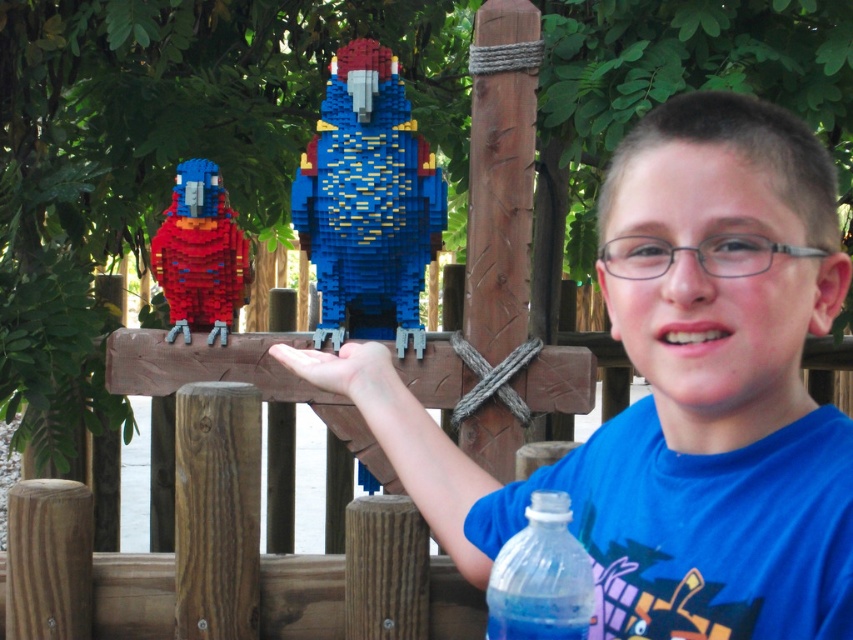
Question: Which point is closer to the camera?

Choices:
 (A) matte flesh-colored hand at center
 (B) blue matte lego figure at upper center
 (C) blue lego parrot at center

Answer: (B)

Question: Which point appears farthest from the camera in this image?

Choices:
 (A) (334, 285)
 (B) (308, 349)
 (C) (532, 563)

Answer: (A)

Question: Can you confirm if blue lego parrot at center is positioned to the right of transparent plastic bottle at lower right?

Choices:
 (A) no
 (B) yes

Answer: (A)

Question: Is blue matte lego figure at upper center wider than transparent plastic bottle at lower right?

Choices:
 (A) no
 (B) yes

Answer: (B)

Question: Which of the following is the closest to the observer?

Choices:
 (A) blue matte lego figure at upper center
 (B) matte plastic parrot at left
 (C) blue lego parrot at center
 (D) matte flesh-colored hand at center

Answer: (A)

Question: Is blue lego parrot at center to the right of matte flesh-colored hand at center from the viewer's perspective?

Choices:
 (A) no
 (B) yes

Answer: (A)